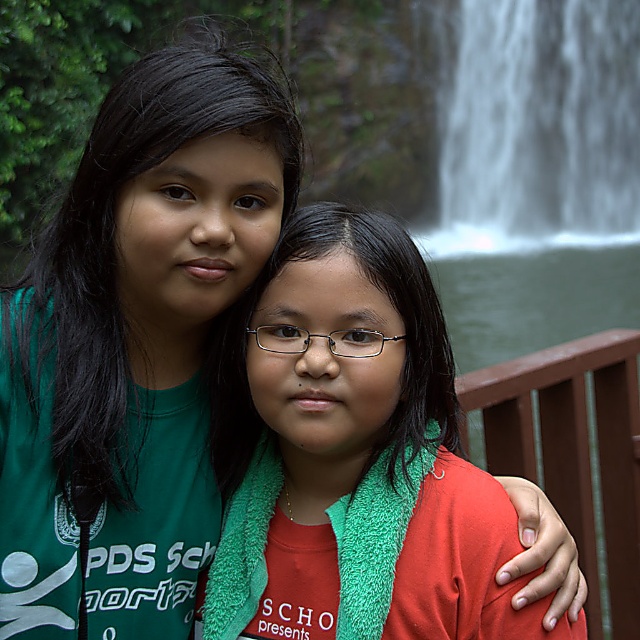
Question: Can you confirm if red fleece scarf at center is positioned above white misty waterfall at upper right?

Choices:
 (A) yes
 (B) no

Answer: (B)

Question: Which point is closer to the camera?

Choices:
 (A) (394, 273)
 (B) (548, 497)

Answer: (A)

Question: Which is nearer to the white misty waterfall at upper right?

Choices:
 (A) red fleece scarf at center
 (B) brown wooden rail at upper right

Answer: (B)

Question: Estimate the real-world distances between objects in this image. Which object is farther from the white misty waterfall at upper right?

Choices:
 (A) red fleece scarf at center
 (B) brown wooden rail at upper right

Answer: (A)

Question: Does white misty waterfall at upper right have a larger size compared to brown wooden rail at upper right?

Choices:
 (A) yes
 (B) no

Answer: (A)

Question: Does white misty waterfall at upper right appear under brown wooden rail at upper right?

Choices:
 (A) no
 (B) yes

Answer: (A)